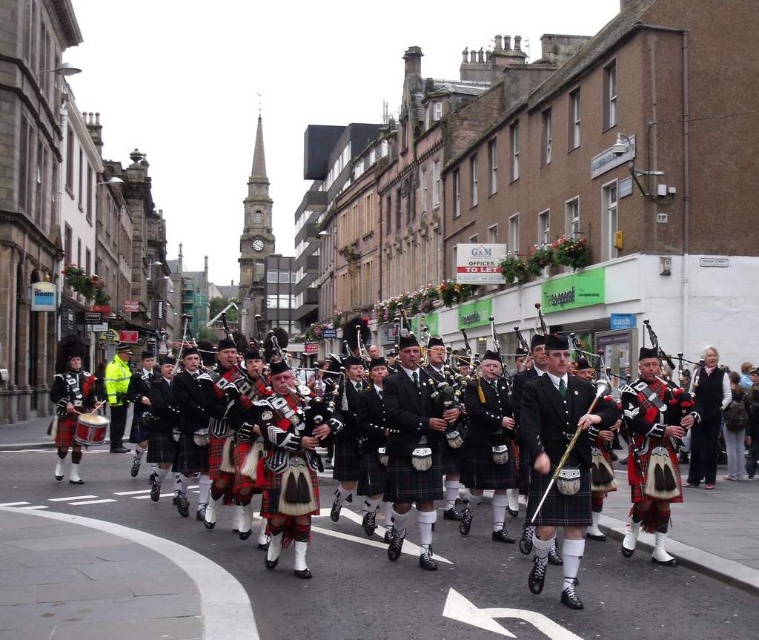
Is point (751, 497) in front of point (455, 435)?

No, it is not.

Between point (723, 547) and point (436, 342), which one is positioned in front?

Point (723, 547) is in front.

Find the location of `matte black kilt at center`. matte black kilt at center is located at coordinates (717, 532).

Is matte black kilt at center bigger than brass drum at center?

Indeed, matte black kilt at center has a larger size compared to brass drum at center.

Locate an element on the screen. Image resolution: width=759 pixels, height=640 pixels. matte black kilt at center is located at coordinates coord(717,532).

Does point (691, 508) lie behind point (101, 413)?

No, it is in front of (101, 413).

In order to click on matte black kilt at center in this screenshot , I will do `click(717, 532)`.

Between polished wood bagpipes at center and brass drum at center, which one is positioned lower?

Positioned lower is brass drum at center.

Is polished wood bagpipes at center wider than brass drum at center?

In fact, polished wood bagpipes at center might be narrower than brass drum at center.

Which is behind, point (452, 426) or point (80, 435)?

Point (80, 435)

The image size is (759, 640). Identify the location of polished wood bagpipes at center. (443, 376).